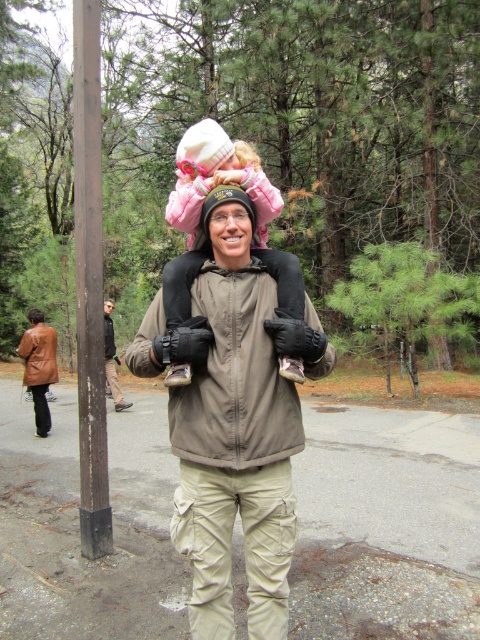
Question: Which of these objects is positioned farthest from the brown wood pole at left?

Choices:
 (A) matte brown jacket at center
 (B) brown leather jacket at lower left
 (C) matte pink jacket at upper center
 (D) brown leather jacket at center

Answer: (D)

Question: Which point is closer to the camera?

Choices:
 (A) (173, 365)
 (B) (83, 358)
 (C) (117, 396)
 (D) (228, 506)

Answer: (A)

Question: Is brown wood pole at left to the left of matte pink jacket at upper center from the viewer's perspective?

Choices:
 (A) yes
 (B) no

Answer: (A)

Question: Which object is farther from the camera taking this photo?

Choices:
 (A) matte brown jacket at center
 (B) matte pink jacket at upper center
 (C) brown leather jacket at lower left

Answer: (C)

Question: In this image, where is brown wood pole at left located relative to brown leather jacket at center?

Choices:
 (A) right
 (B) left

Answer: (A)

Question: Is brown wood pole at left further to camera compared to brown leather jacket at center?

Choices:
 (A) yes
 (B) no

Answer: (B)